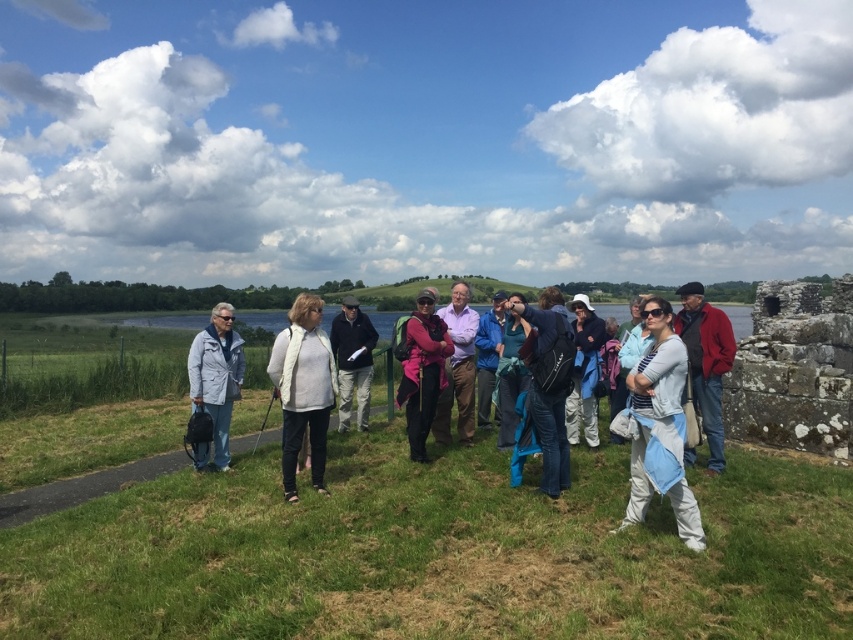
Who is taller, red woolen jacket at center or purple cotton shirt at center?

Standing taller between the two is purple cotton shirt at center.

The height and width of the screenshot is (640, 853). Identify the location of red woolen jacket at center. (706, 362).

Can you confirm if matte black jacket at center is positioned below blue fabric at center?

No.

How much distance is there between matte black jacket at center and blue fabric at center?

matte black jacket at center is 7.52 feet from blue fabric at center.

Who is more distant from viewer, (341,339) or (502,433)?

Positioned behind is point (341,339).

You are a GUI agent. You are given a task and a screenshot of the screen. Output one action in this format:
    pyautogui.click(x=<x>, y=<y>)
    Task: Click on the matte black jacket at center
    
    Given the screenshot: What is the action you would take?
    pyautogui.click(x=352, y=360)

Does light blue denim jacket at lower left have a smaller size compared to light blue denim jacket at center?

Yes.

Can you confirm if light blue denim jacket at lower left is bigger than light blue denim jacket at center?

Incorrect, light blue denim jacket at lower left is not larger than light blue denim jacket at center.

Between point (202, 372) and point (577, 396), which one is positioned in front?

Positioned in front is point (202, 372).

At what (x,y) coordinates should I click in order to perform the action: click on light blue denim jacket at lower left. Please return your answer as a coordinate pair (x, y). Looking at the image, I should click on (216, 376).